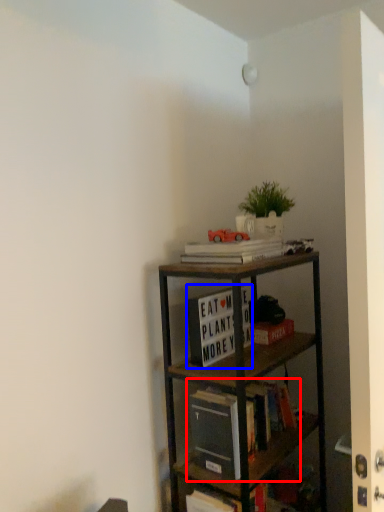
Question: Among these objects, which one is nearest to the camera, book (highlighted by a red box) or book (highlighted by a blue box)?

Choices:
 (A) book
 (B) book

Answer: (A)